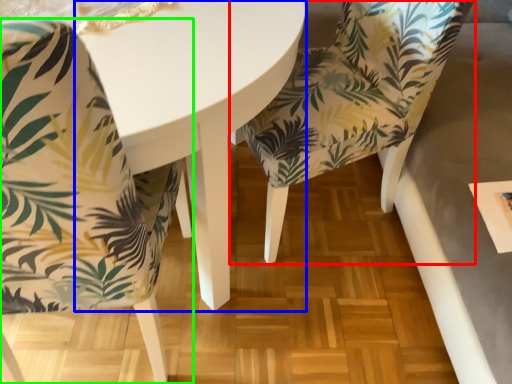
Question: Estimate the real-world distances between objects in this image. Which object is closer to chair (highlighted by a red box), round table (highlighted by a blue box) or chair (highlighted by a green box)?

Choices:
 (A) round table
 (B) chair

Answer: (A)